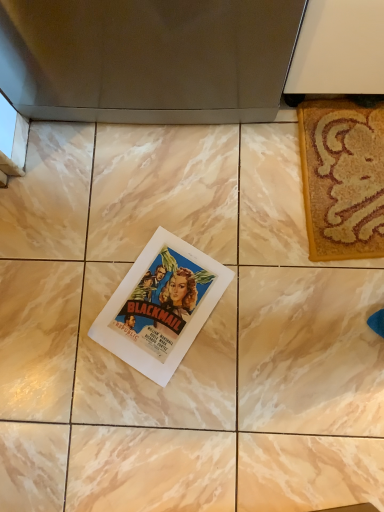
Find the location of `empty space that is ontop of white paper at center (from a real-world perspective)`. empty space that is ontop of white paper at center (from a real-world perspective) is located at coordinates (168, 300).